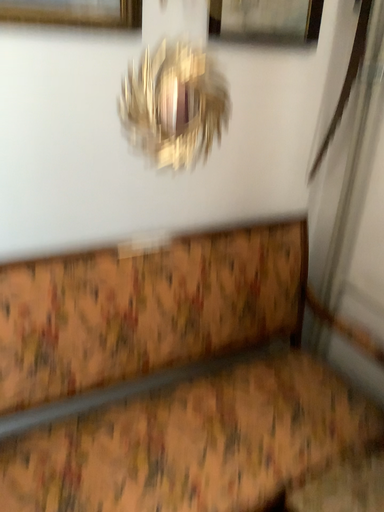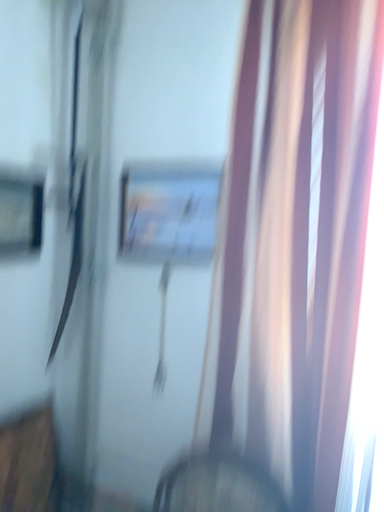
Question: Which way did the camera rotate in the video?

Choices:
 (A) rotated upward
 (B) rotated downward

Answer: (A)